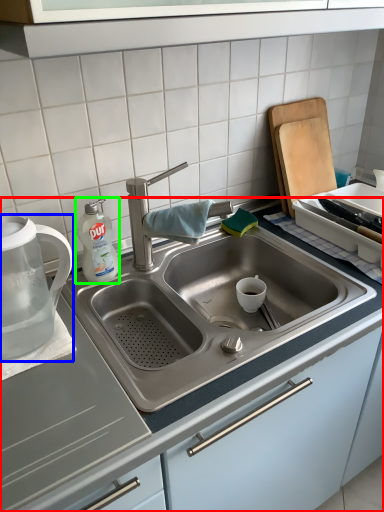
Question: Based on their relative distances, which object is nearer to countertop (highlighted by a red box)? Choose from tea pot (highlighted by a blue box) and cleaning product (highlighted by a green box).

Choices:
 (A) tea pot
 (B) cleaning product

Answer: (A)